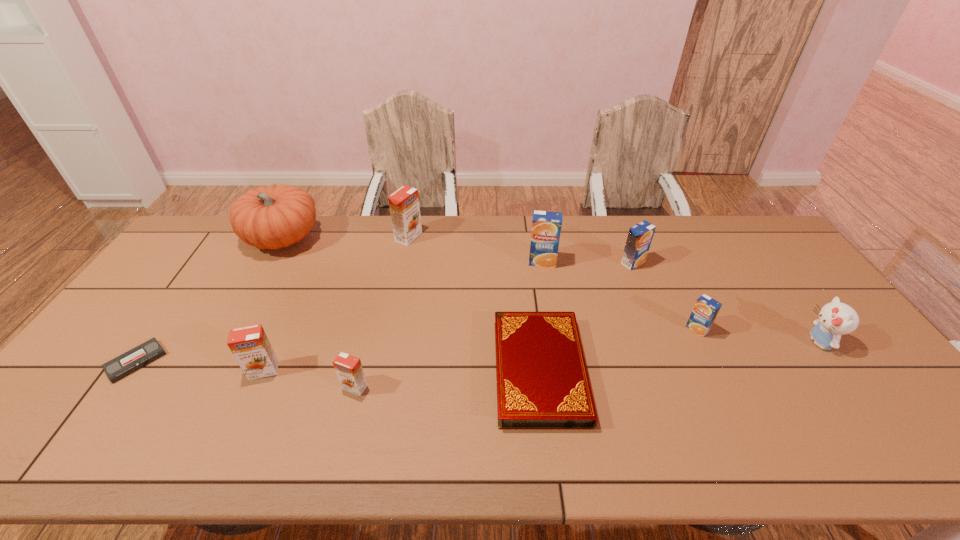
The image size is (960, 540). Find the location of `orange juice that is the fifth nearest to the biggest blue orange_juice`. orange juice that is the fifth nearest to the biggest blue orange_juice is located at coordinates (250, 346).

Where is `the second closest orange orange juice to the second blue orange_juice from right to left`? This screenshot has height=540, width=960. the second closest orange orange juice to the second blue orange_juice from right to left is located at coordinates (348, 368).

This screenshot has height=540, width=960. Identify the location of orange orange juice object that ranks as the third closest to the biggest blue orange_juice. (250, 346).

Identify which blue orange_juice is the second nearest to the third orange juice from right to left. Please provide its 2D coordinates. Your answer should be formatted as a tuple, i.e. [(x, y)], where the tuple contains the x and y coordinates of a point satisfying the conditions above.

[(706, 309)]

The height and width of the screenshot is (540, 960). I want to click on the closest blue orange_juice to the leftmost blue orange_juice, so point(640,236).